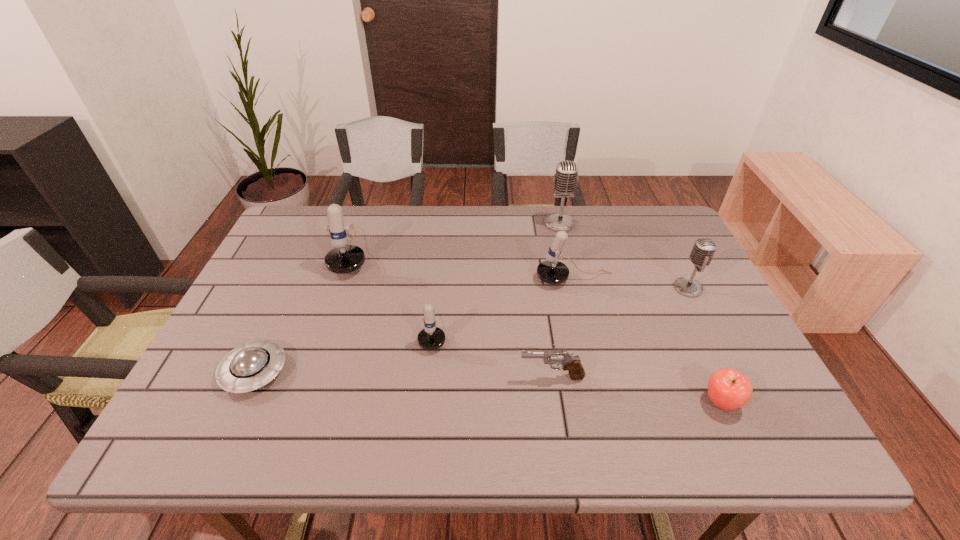
Image resolution: width=960 pixels, height=540 pixels. What are the coordinates of `vacant space that is in between the biggest white microphone and the pistol` in the screenshot? It's located at (452, 314).

What are the coordinates of `vacant point located between the rightmost microphone and the gray pistol` in the screenshot? It's located at (620, 333).

You are a GUI agent. You are given a task and a screenshot of the screen. Output one action in this format:
    pyautogui.click(x=<x>, y=<y>)
    Task: Click on the free space between the nearer gray microphone and the biggest white microphone
    
    Given the screenshot: What is the action you would take?
    pyautogui.click(x=520, y=269)

Locate an element on the screen. This screenshot has width=960, height=540. object that is the third closest to the left gray microphone is located at coordinates (431, 337).

The image size is (960, 540). I want to click on object that is the seventh closest one to the left gray microphone, so click(252, 365).

You are a GUI agent. You are given a task and a screenshot of the screen. Output one action in this format:
    pyautogui.click(x=<x>, y=<y>)
    Task: Click on the microphone object that ranks as the fourth closest to the leftmost white microphone
    The image size is (960, 540).
    Given the screenshot: What is the action you would take?
    pyautogui.click(x=703, y=250)

Locate an element on the screen. The width and height of the screenshot is (960, 540). the closest microphone to the leftmost microphone is located at coordinates (431, 337).

Find the location of a particular element. The image size is (960, 540). white microphone object that ranks as the third closest to the gray saucer is located at coordinates (551, 271).

Identify which white microphone is the second nearest to the leftmost microphone. Please provide its 2D coordinates. Your answer should be formatted as a tuple, i.e. [(x, y)], where the tuple contains the x and y coordinates of a point satisfying the conditions above.

[(551, 271)]

At what (x,y) coordinates should I click in order to perform the action: click on free location that satisfies the following two spatial constraints: 1. at the barrel of the apple; 2. on the left side of the pistol. Please return your answer as a coordinate pair (x, y). The image size is (960, 540). Looking at the image, I should click on (556, 402).